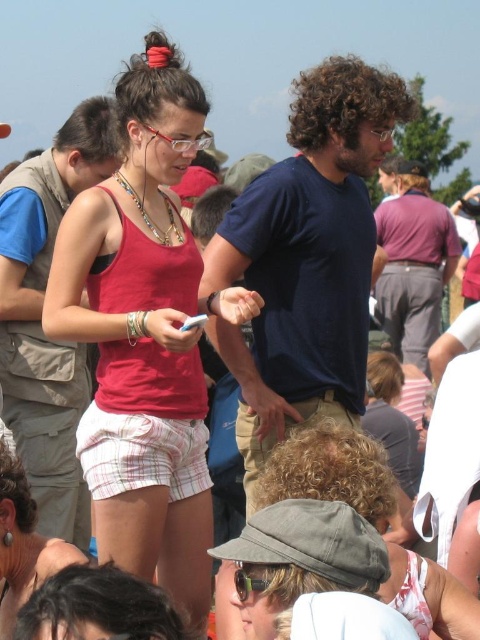
Can you confirm if dark blue t-shirt at center is shorter than matte pink shorts at center?

No.

Which of these two, dark blue t-shirt at center or matte pink shorts at center, stands taller?

dark blue t-shirt at center

Between point (392, 90) and point (22, 580), which one is positioned behind?

The point (392, 90) is behind.

The image size is (480, 640). Identify the location of dark blue t-shirt at center. [x=307, y=257].

Which is in front, point (115, 138) or point (1, 628)?

Point (1, 628)

What do you see at coordinates (40, 316) in the screenshot? I see `matte blue shirt at center` at bounding box center [40, 316].

Locate an element on the screen. This screenshot has height=640, width=480. matte blue shirt at center is located at coordinates pos(40,316).

Which is behind, point (40, 310) or point (415, 620)?

Positioned behind is point (40, 310).

Is matte blue shirt at center positioned in front of gray fabric cap at center?

That is False.

Between point (21, 451) and point (475, 609), which one is positioned in front?

Point (475, 609) is more forward.

At what (x,y) coordinates should I click in order to perform the action: click on matte blue shirt at center. Please return your answer as a coordinate pair (x, y). This screenshot has width=480, height=640. Looking at the image, I should click on (40, 316).